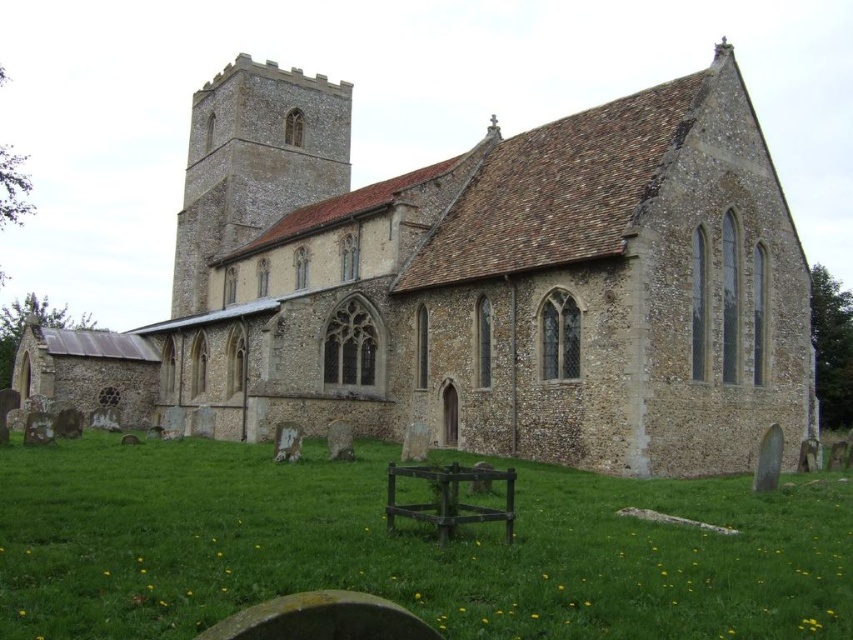
Who is taller, brown stone church at center or green grass at lower center?

brown stone church at center is taller.

Who is positioned more to the left, brown stone church at center or green grass at lower center?

brown stone church at center is more to the left.

Is point (709, 128) farther from viewer compared to point (674, 611)?

Yes, it is behind point (674, 611).

Find the location of a particular element. The image size is (853, 640). brown stone church at center is located at coordinates (473, 285).